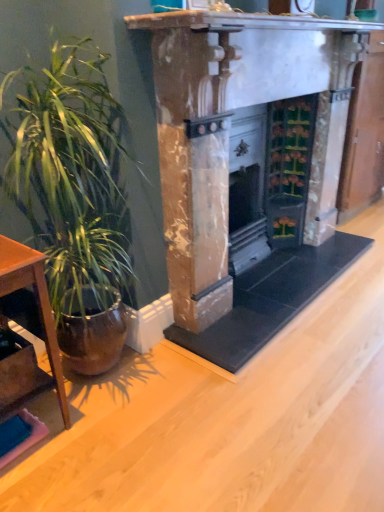
Question: From a real-world perspective, is green glossy plant at left positioned over brown wooden table at left based on gravity?

Choices:
 (A) no
 (B) yes

Answer: (B)

Question: Can we say green glossy plant at left lies outside brown wooden table at left?

Choices:
 (A) no
 (B) yes

Answer: (B)

Question: Is green glossy plant at left thinner than brown wooden table at left?

Choices:
 (A) yes
 (B) no

Answer: (B)

Question: Is green glossy plant at left to the right of brown wooden table at left from the viewer's perspective?

Choices:
 (A) yes
 (B) no

Answer: (A)

Question: Would you say brown wooden table at left is part of green glossy plant at left's contents?

Choices:
 (A) no
 (B) yes

Answer: (A)

Question: Is brown wooden table at left inside the boundaries of green glossy plant at left, or outside?

Choices:
 (A) inside
 (B) outside

Answer: (B)

Question: Relative to green glossy plant at left, is brown wooden table at left in front or behind?

Choices:
 (A) front
 (B) behind

Answer: (B)

Question: Considering the positions of point (41, 261) and point (87, 164), is point (41, 261) closer or farther from the camera than point (87, 164)?

Choices:
 (A) closer
 (B) farther

Answer: (A)

Question: In terms of width, does brown wooden table at left look wider or thinner when compared to green glossy plant at left?

Choices:
 (A) wide
 (B) thin

Answer: (B)

Question: Would you say green glossy plant at left is to the left or to the right of marble fireplace at center in the picture?

Choices:
 (A) left
 (B) right

Answer: (A)

Question: In terms of size, does green glossy plant at left appear bigger or smaller than marble fireplace at center?

Choices:
 (A) small
 (B) big

Answer: (A)

Question: Is point (105, 159) positioned closer to the camera than point (226, 243)?

Choices:
 (A) closer
 (B) farther

Answer: (A)

Question: Looking at their shapes, would you say green glossy plant at left is wider or thinner than marble fireplace at center?

Choices:
 (A) thin
 (B) wide

Answer: (A)

Question: Is green glossy plant at left situated inside brown wooden table at left or outside?

Choices:
 (A) outside
 (B) inside

Answer: (A)

Question: Is green glossy plant at left to the left or to the right of brown wooden table at left in the image?

Choices:
 (A) left
 (B) right

Answer: (B)